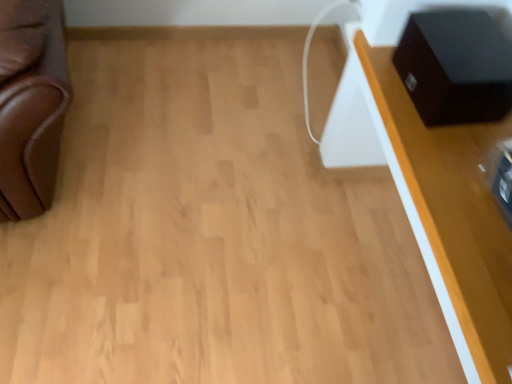
Question: In terms of size, does white glossy table at upper right appear bigger or smaller than black matte speaker at upper right?

Choices:
 (A) small
 (B) big

Answer: (B)

Question: From a real-world perspective, relative to black matte speaker at upper right, is white glossy table at upper right vertically above or below?

Choices:
 (A) above
 (B) below

Answer: (B)

Question: Would you say white glossy table at upper right is to the left or to the right of black matte speaker at upper right in the picture?

Choices:
 (A) right
 (B) left

Answer: (A)

Question: From their relative heights in the image, would you say black matte speaker at upper right is taller or shorter than white glossy table at upper right?

Choices:
 (A) tall
 (B) short

Answer: (B)

Question: Is point (509, 104) positioned closer to the camera than point (451, 198)?

Choices:
 (A) farther
 (B) closer

Answer: (A)

Question: In terms of width, does black matte speaker at upper right look wider or thinner when compared to white glossy table at upper right?

Choices:
 (A) thin
 (B) wide

Answer: (A)

Question: Based on their sizes in the image, would you say black matte speaker at upper right is bigger or smaller than white glossy table at upper right?

Choices:
 (A) big
 (B) small

Answer: (B)